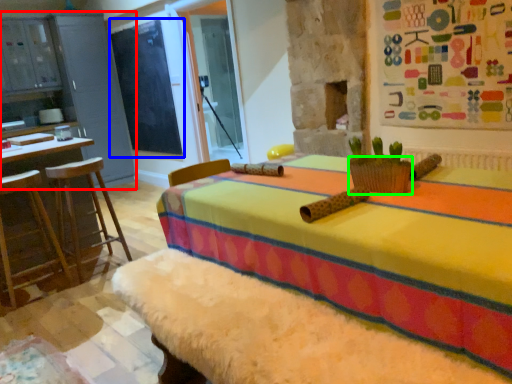
Question: Estimate the real-world distances between objects in this image. Which object is farther from dresser (highlighted by a red box), bulletin board (highlighted by a blue box) or basket (highlighted by a green box)?

Choices:
 (A) bulletin board
 (B) basket

Answer: (B)